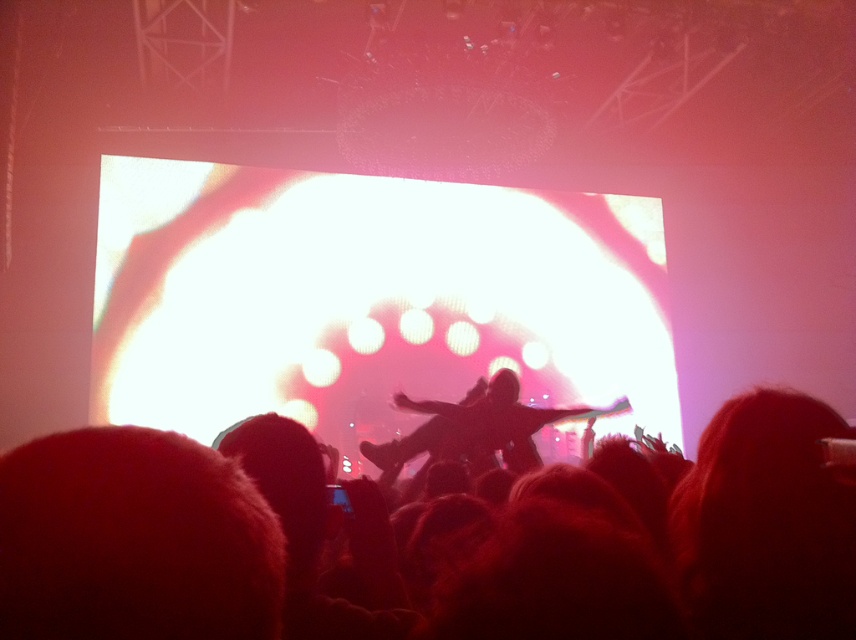
Question: Is silhouette hair at center smaller than silhouette figure at center?

Choices:
 (A) no
 (B) yes

Answer: (B)

Question: Among these objects, which one is farthest from the camera?

Choices:
 (A) silhouette figure at center
 (B) silhouette hair at center

Answer: (A)

Question: Which object appears farthest from the camera in this image?

Choices:
 (A) silhouette hair at center
 (B) silhouette figure at center

Answer: (B)

Question: Can you confirm if silhouette hair at center is positioned to the left of silhouette figure at center?

Choices:
 (A) no
 (B) yes

Answer: (B)

Question: Which of the following is the closest to the observer?

Choices:
 (A) (698, 582)
 (B) (491, 380)

Answer: (A)

Question: Does silhouette hair at center appear over silhouette figure at center?

Choices:
 (A) yes
 (B) no

Answer: (A)